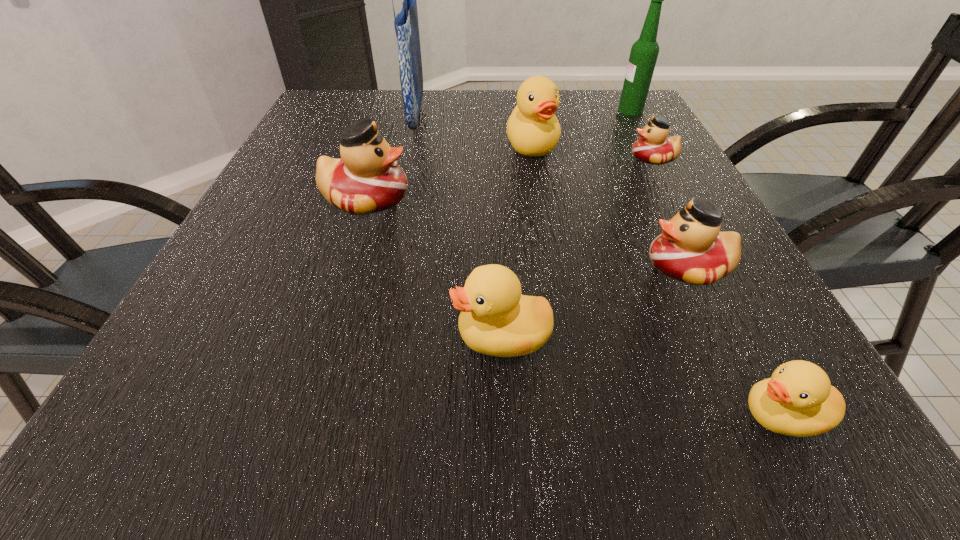
Locate an element on the screen. The image size is (960, 540). vacant space that satisfies the following two spatial constraints: 1. on the label of the seventh shortest object; 2. at the beak of the biggest yellow duck is located at coordinates (650, 145).